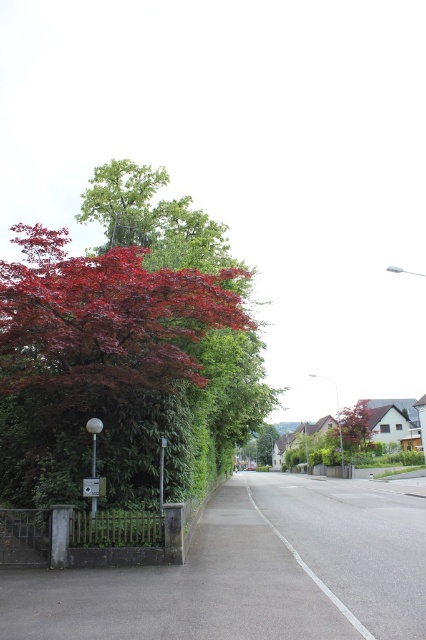
You are a painter standing on the sidewalk. You want to paint both the smooth red tree at right and the metallic gray street sign at lower left. Which object should you look up more to paint?

The smooth red tree at right has a greater height compared to the metallic gray street sign at lower left, so you should look up more to paint the smooth red tree at right.

You are standing on the sidewalk and want to take a photo of the glossy red maple tree at left. Where should you position yourself to capture the tree in the center of your camera viewfinder?

To center the glossy red maple tree at left in your camera viewfinder, position yourself directly in front of the tree at point (100, 364).